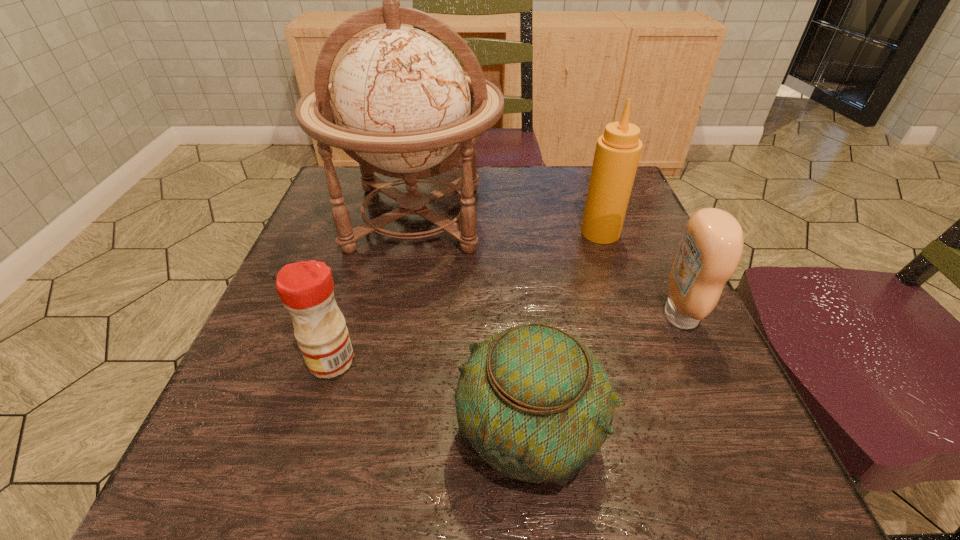
Find the location of a particular element. This screenshot has height=540, width=960. free space located on the label of the rightmost condiment is located at coordinates (606, 316).

This screenshot has width=960, height=540. I want to click on vacant region located on the label of the rightmost condiment, so click(473, 316).

Find the location of a particular element. vacant space located on the back of the leftmost condiment is located at coordinates (362, 264).

Find the location of a particular element. free space located on the right of the shortest object is located at coordinates (666, 431).

In order to click on object that is at the far edge in this screenshot , I will do `click(400, 104)`.

The image size is (960, 540). Find the location of `object present at the near edge`. object present at the near edge is located at coordinates (536, 404).

The image size is (960, 540). Identify the location of globe that is at the left edge. (400, 104).

The height and width of the screenshot is (540, 960). Find the location of `condiment at the left edge`. condiment at the left edge is located at coordinates (306, 289).

Locate an element on the screen. object that is at the far left corner is located at coordinates (400, 104).

The width and height of the screenshot is (960, 540). I want to click on vacant region at the far edge of the desktop, so click(x=523, y=179).